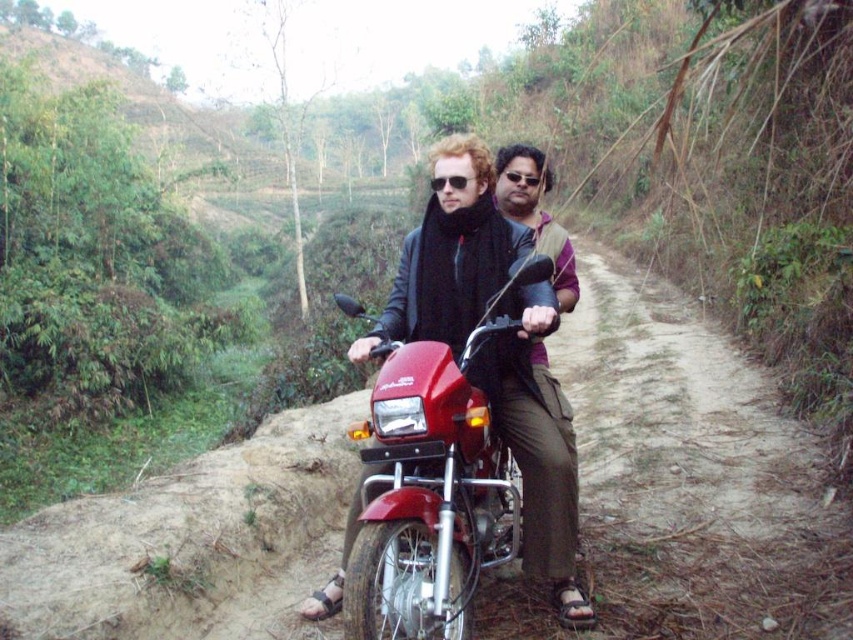
You are standing at the point marked by coordinates point (x=457, y=244). What object are you standing on?

You are standing on the matte black motorcycle at center marked by the point (x=457, y=244).